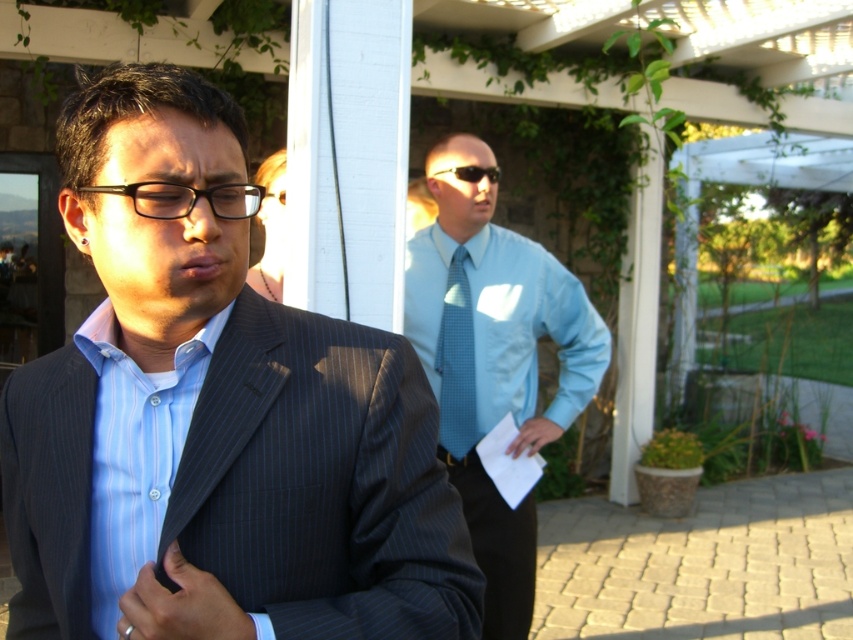
You are a fashion designer analyzing the image. You need to determine the spatial relationship between the pinstriped suit at center and the blue textured tie at center. Which one is positioned lower in the image?

The pinstriped suit at center is located below the blue textured tie at center, so the pinstriped suit at center is positioned lower in the image.

You are a fashion designer analyzing the outfit of two men in the image. Which item is positioned lower on the body between the light blue striped dress shirt at left and the blue textured tie at center?

The light blue striped dress shirt at left is positioned lower on the body than the blue textured tie at center.

You are a photographer trying to capture a candid shot of both the light blue shirt at center and the blue textured tie at center. Since you want to ensure both are visible, which object should you position closer to the camera to avoid overlap?

The light blue shirt at center is positioned on the right side of the blue textured tie at center, so positioning the light blue shirt at center closer to the camera would ensure both are visible without overlapping.